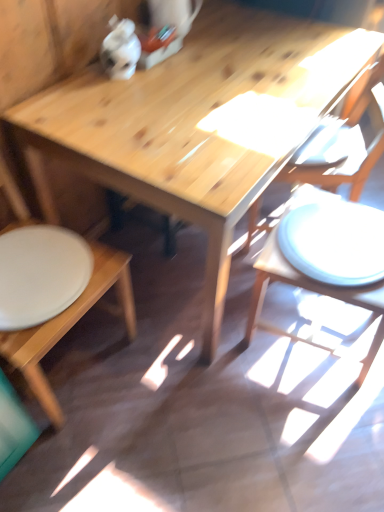
In order to click on vacant region above white matte plate at lower left (from a real-world perspective) in this screenshot , I will do `click(33, 263)`.